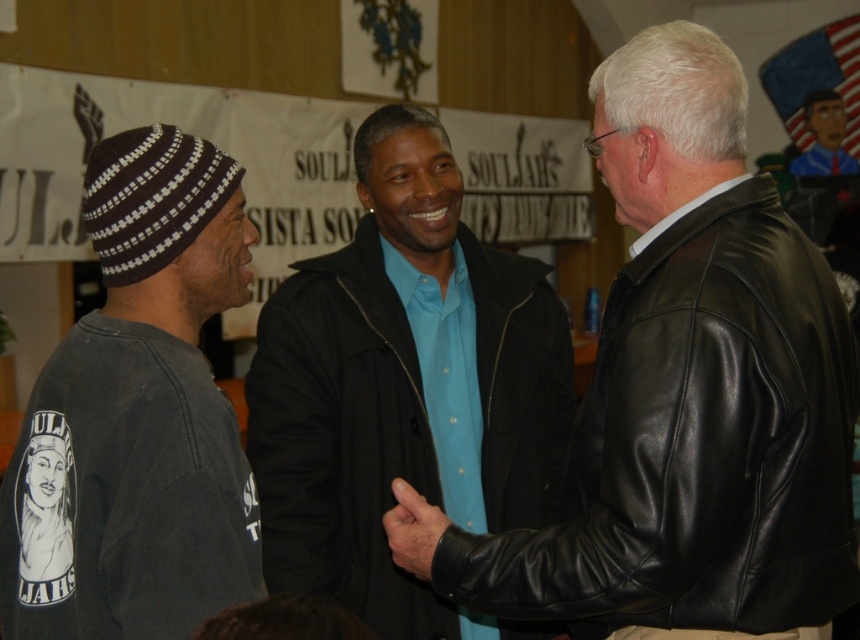
You are organizing a charity clothing drive and need to determine which jackets can fit into a standard donation box that accommodates items up to the size of the blue matte jacket at center. Can the black leather jacket at right be placed inside the box?

The black leather jacket at right is larger in size than the blue matte jacket at center, so it cannot fit into the donation box designed for items up to the size of the blue matte jacket at center.

What is located at the coordinates point (685, 394)?

The black leather jacket at right is located at point (685, 394).

You are a photographer standing in front of the banner. You want to take a photo of the black leather jacket at right without including the banner in the background. Can you step back enough to do so?

The black leather jacket at right is 1.77 meters from the camera. Since the banner is in the background, stepping back might allow you to frame the shot so the jacket is centered while the banner is out of frame, but this depends on the lens and camera angle. However, based on the given distance, stepping back could work.